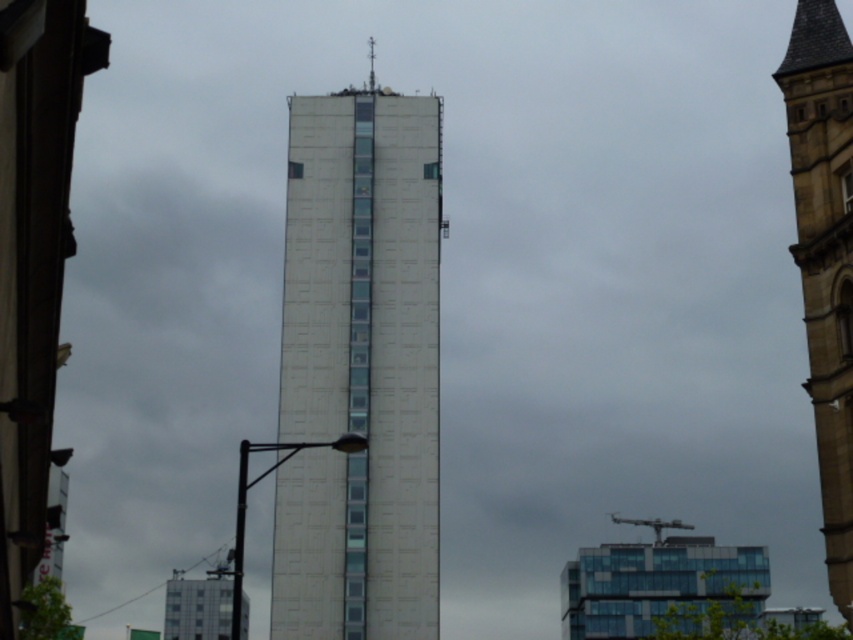
Question: Which object is positioned closest to the metallic spire at upper center?

Choices:
 (A) stone tower at center
 (B) white textured building at center

Answer: (B)

Question: Estimate the real-world distances between objects in this image. Which object is farther from the white textured building at center?

Choices:
 (A) metallic spire at upper center
 (B) stone tower at center

Answer: (B)

Question: Is stone tower at center bigger than metallic spire at upper center?

Choices:
 (A) no
 (B) yes

Answer: (A)

Question: Which of the following is the closest to the observer?

Choices:
 (A) white textured building at center
 (B) stone tower at center

Answer: (B)

Question: Can you confirm if white textured building at center is bigger than stone tower at center?

Choices:
 (A) no
 (B) yes

Answer: (B)

Question: Can you confirm if white textured building at center is thinner than metallic spire at upper center?

Choices:
 (A) yes
 (B) no

Answer: (B)